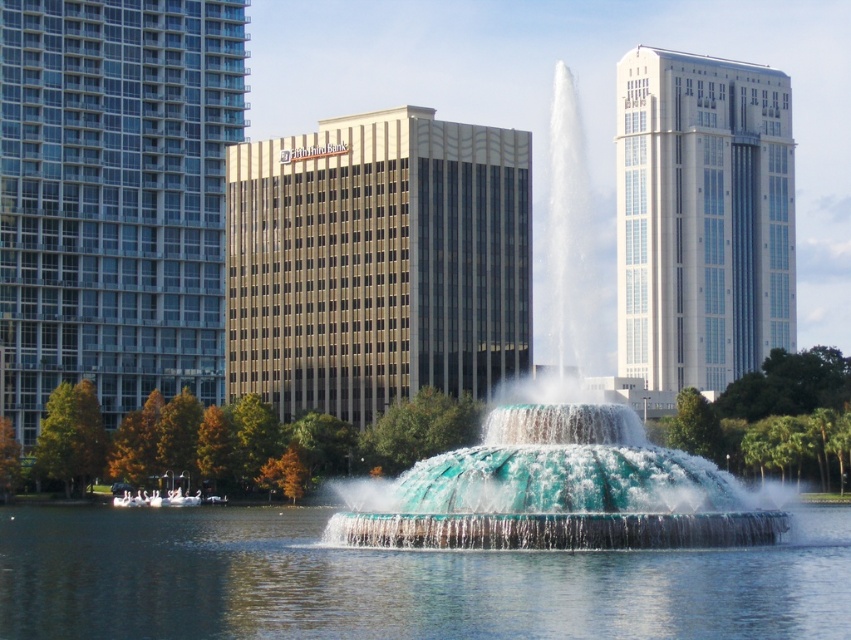
Question: Is clear water at center wider than translucent glass water at center?

Choices:
 (A) no
 (B) yes

Answer: (B)

Question: Which object appears closest to the camera in this image?

Choices:
 (A) translucent glass water at center
 (B) clear water at center

Answer: (B)

Question: Does clear water at center appear on the left side of translucent glass water at center?

Choices:
 (A) no
 (B) yes

Answer: (B)

Question: Which point is farther to the camera?

Choices:
 (A) clear water at center
 (B) translucent glass water at center

Answer: (B)

Question: Can you confirm if clear water at center is positioned to the right of translucent glass water at center?

Choices:
 (A) yes
 (B) no

Answer: (B)

Question: Which point is farther to the camera?

Choices:
 (A) (250, 513)
 (B) (511, 445)

Answer: (A)